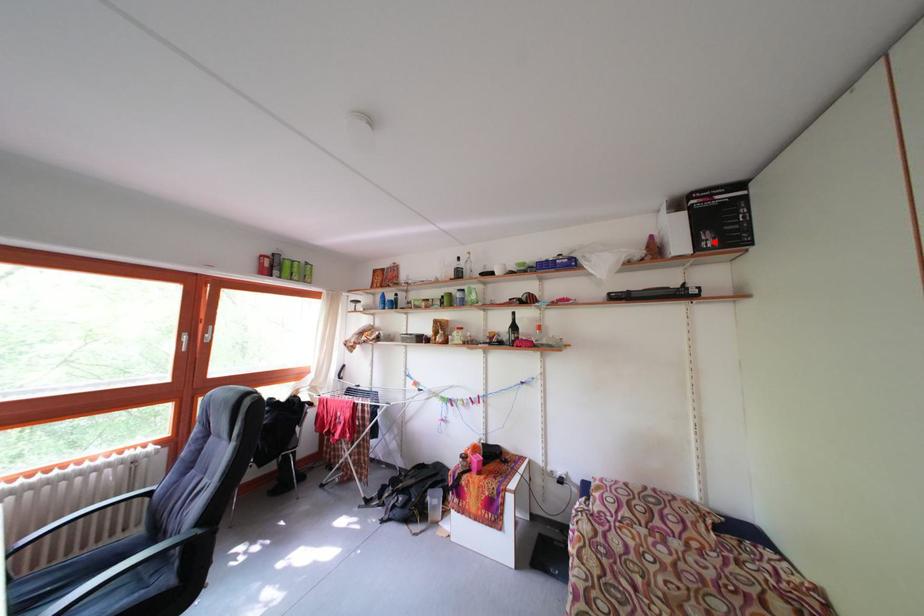
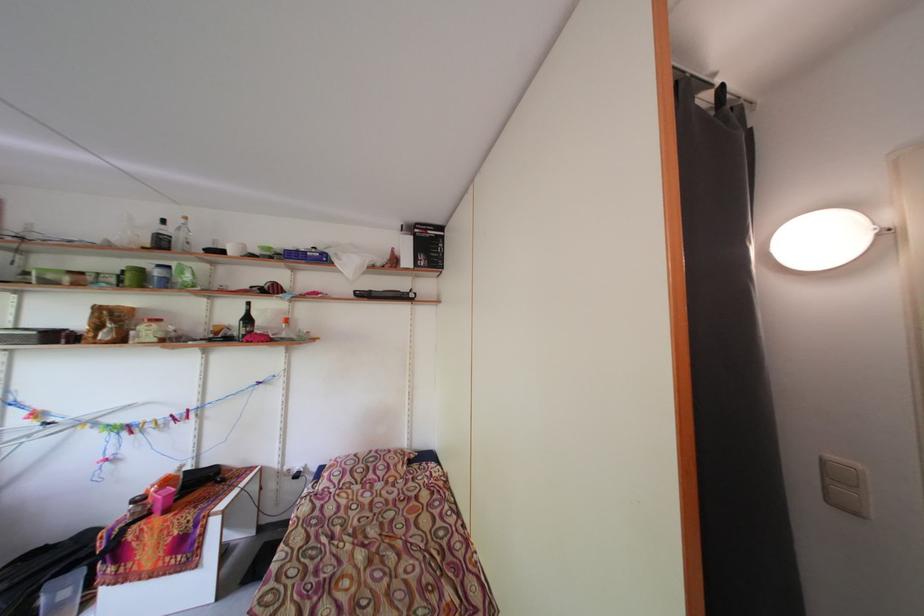
The point at the highlighted location is marked in the first image. Where is the corresponding point in the second image?

(430, 262)